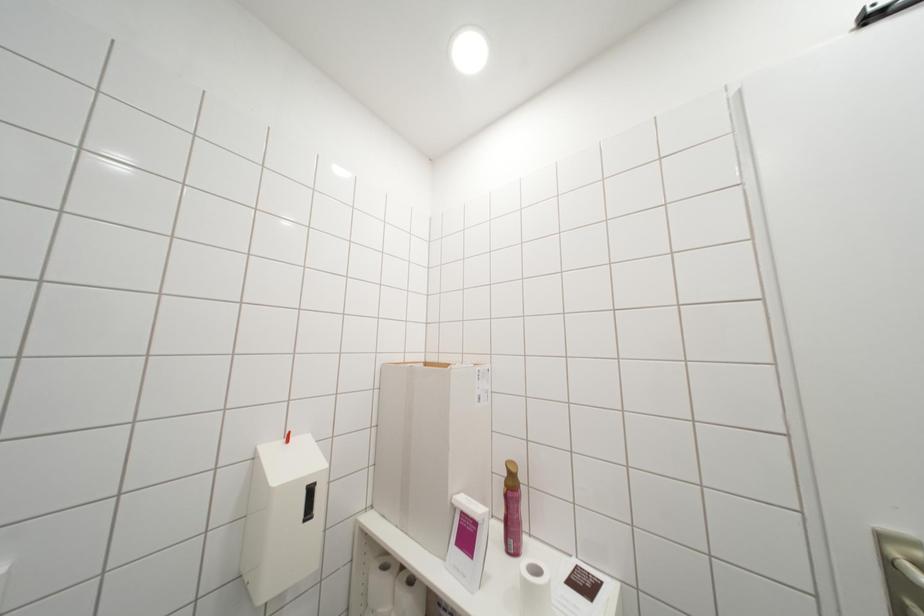
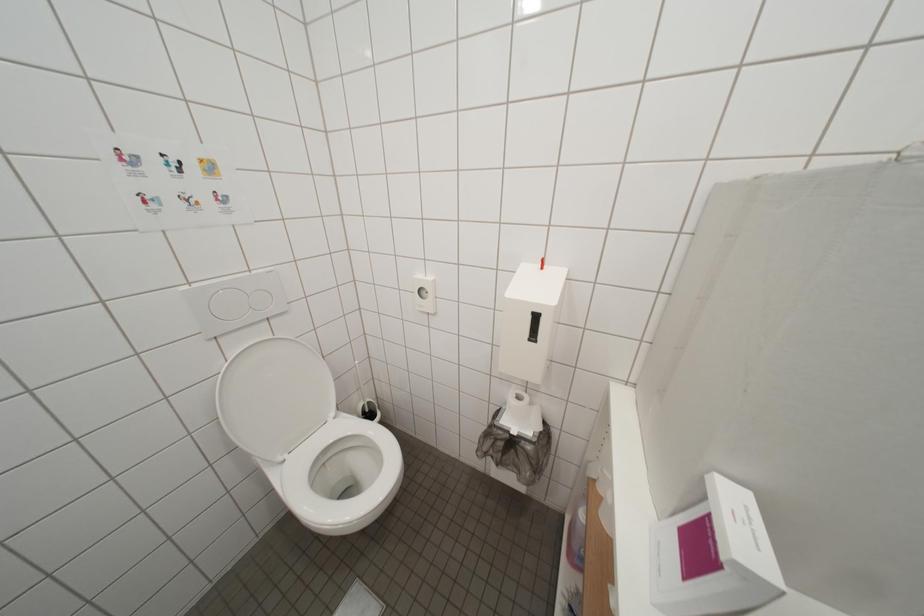
The first image is from the beginning of the video and the second image is from the end. How did the camera likely rotate when shooting the video?

The camera rotated toward left-down.